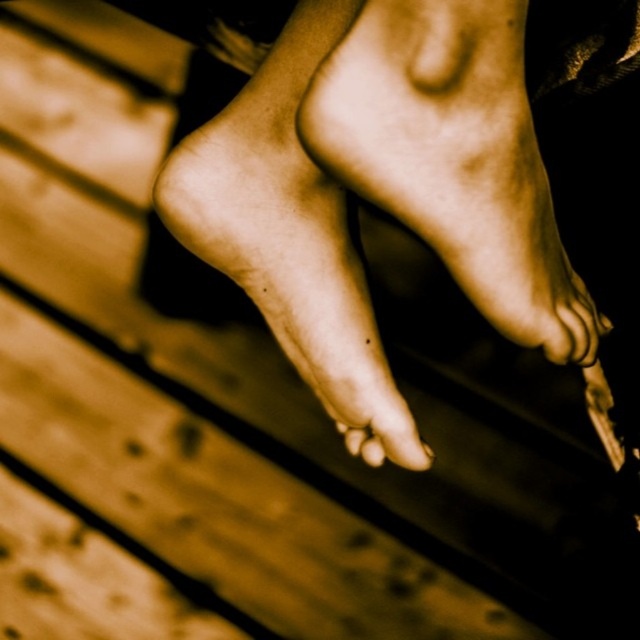
Looking at the two smooth skin parts in the image, the smooth skin foot at center and the smooth skin toe at center, which one takes up more space in the picture?

The smooth skin foot at center is larger in size than the smooth skin toe at center, so it takes up more space in the picture.

You are standing in front of the wooden surface shown in the image. There are two points marked on it, point (458, 154) and point (349, 435). If you were to walk towards the wooden surface, which point would you encounter first?

Point (458, 154) is in front of point (349, 435), so you would encounter point (458, 154) first when approaching the wooden surface.